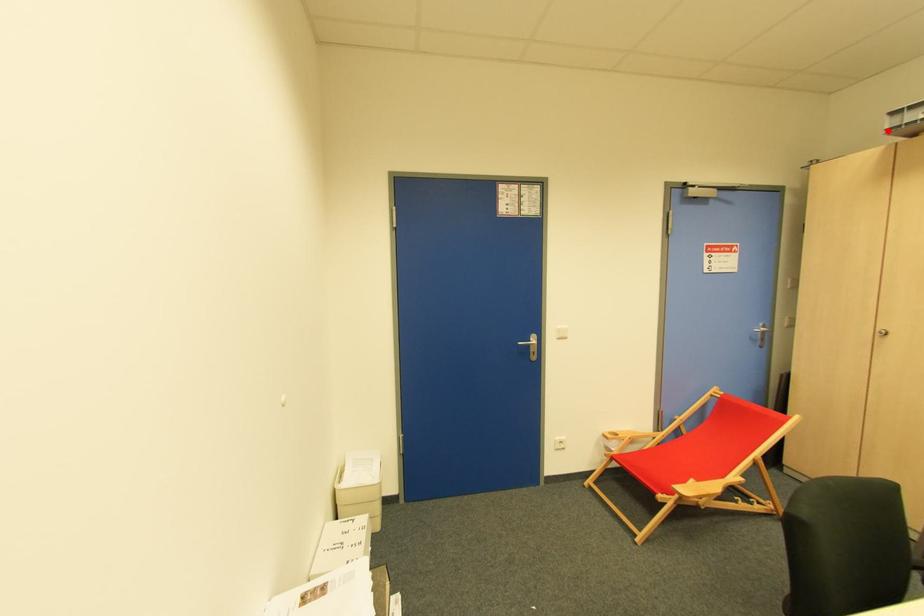
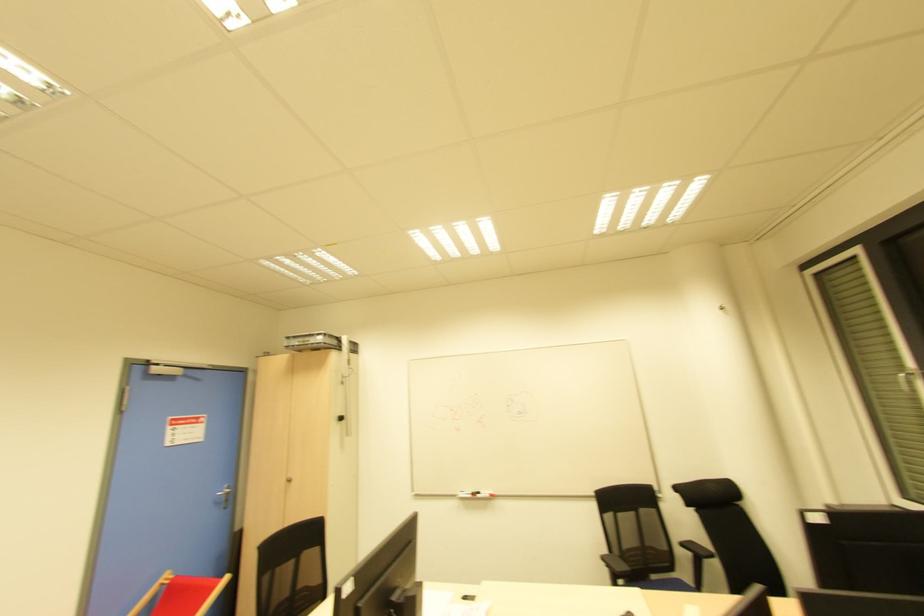
Find the pixel in the second image that matches the highlighted location in the first image.

(286, 347)